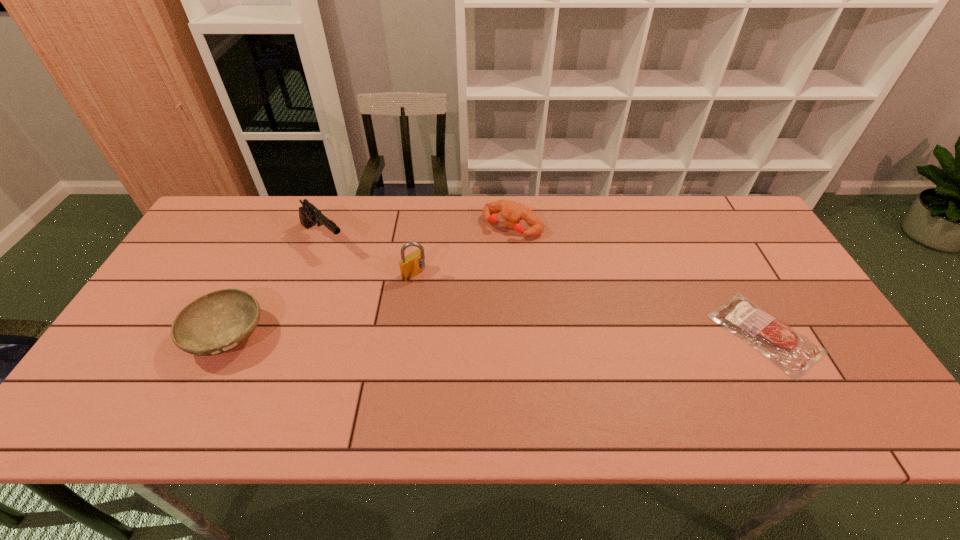
At what (x,y) coordinates should I click in order to perform the action: click on vacant space on the desktop that is between the bowl and the rightmost object and is positioned on the side with the combination dials of the third object from left to right. Please return your answer as a coordinate pair (x, y). Image resolution: width=960 pixels, height=540 pixels. Looking at the image, I should click on (498, 335).

Locate an element on the screen. This screenshot has height=540, width=960. vacant spot on the desktop that is between the bowl and the shortest object and is positioned at the end of the barrel of the gun is located at coordinates (433, 335).

I want to click on vacant space on the desktop that is between the bowl and the shortest object and is positioned with the gloves of the fourth object from left to right facing forward, so click(423, 335).